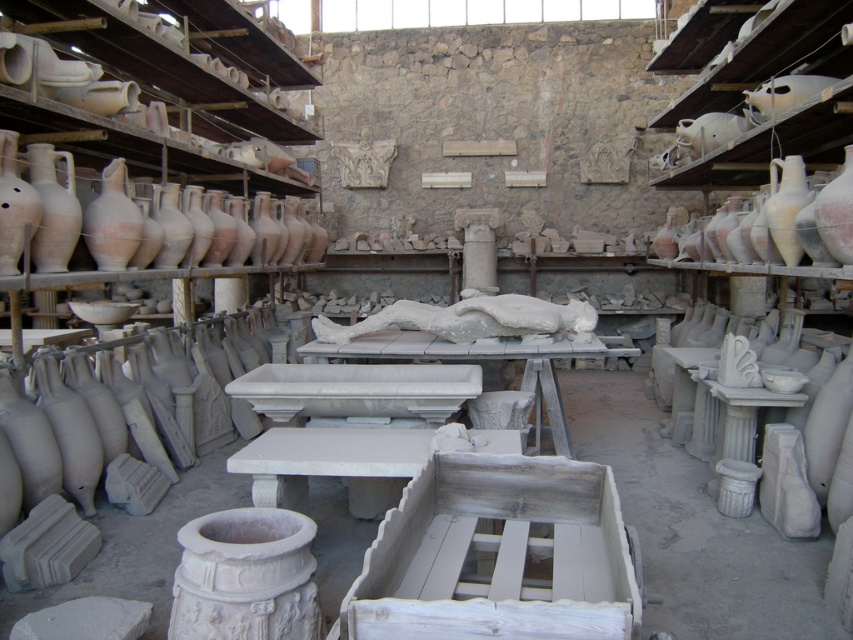
Question: Which point is farther from the camera taking this photo?

Choices:
 (A) (50, 164)
 (B) (842, 205)

Answer: (A)

Question: Which point appears closest to the camera in this image?

Choices:
 (A) (778, 152)
 (B) (775, 244)

Answer: (B)

Question: Which object appears closest to the camera in this image?

Choices:
 (A) matte white amphora at right
 (B) matte clay amphora at left
 (C) matte clay vase at left
 (D) white matte amphora at upper right

Answer: (B)

Question: Can you confirm if matte white amphora at right is thinner than matte clay vase at left?

Choices:
 (A) yes
 (B) no

Answer: (B)

Question: Is white matte amphora at upper right above matte clay amphora at left?

Choices:
 (A) yes
 (B) no

Answer: (A)

Question: Is white matte sculpture at center wider than matte clay vase at left?

Choices:
 (A) no
 (B) yes

Answer: (B)